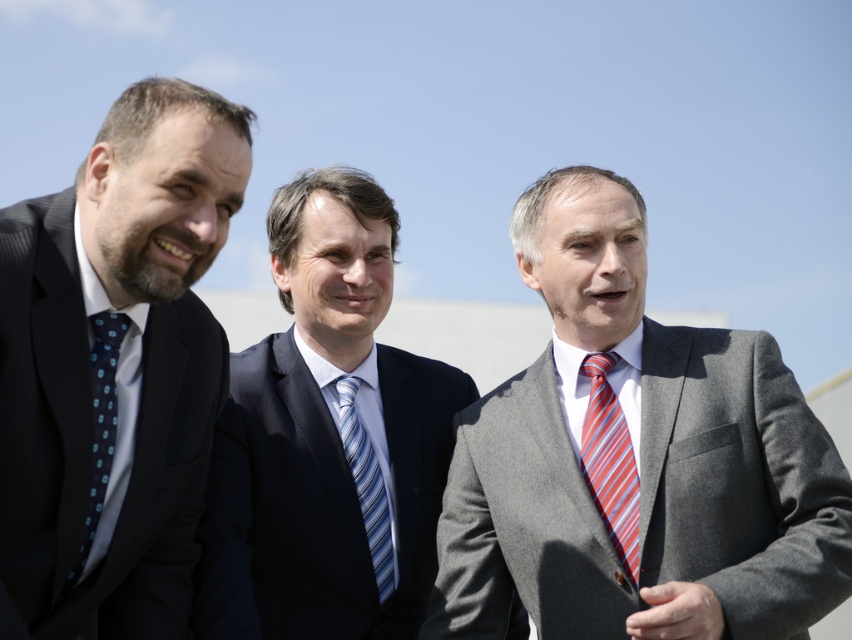
Question: Which of the following is the farthest from the observer?

Choices:
 (A) dark blue pinstripe suit at left
 (B) gray wool suit at center
 (C) blue striped tie at center

Answer: (C)

Question: Can you confirm if gray wool suit at center is smaller than blue striped tie at center?

Choices:
 (A) yes
 (B) no

Answer: (A)

Question: Which point is farther to the camera?

Choices:
 (A) (204, 221)
 (B) (352, 476)
 (C) (616, 433)
 (D) (119, 316)

Answer: (B)

Question: Estimate the real-world distances between objects in this image. Which object is farther from the blue striped tie at center?

Choices:
 (A) blue dotted tie at left
 (B) navy blue suit at center
 (C) dark blue pinstripe suit at left
 (D) striped silk tie at right

Answer: (A)

Question: Is gray wool suit at center thinner than blue striped tie at center?

Choices:
 (A) yes
 (B) no

Answer: (A)

Question: Does dark blue pinstripe suit at left have a greater width compared to blue striped tie at center?

Choices:
 (A) no
 (B) yes

Answer: (A)